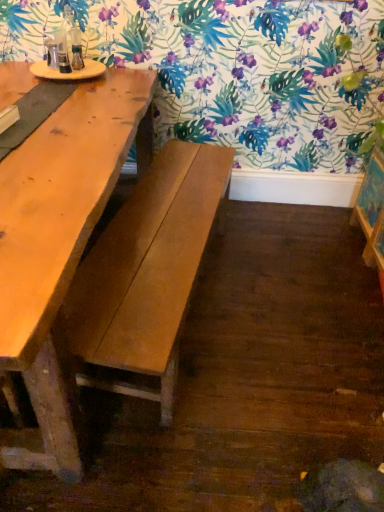
The height and width of the screenshot is (512, 384). What are the coordinates of `smooth wood bench at center` in the screenshot? It's located at (148, 271).

What is the approximate height of smooth wood bench at center?

smooth wood bench at center is 19.23 inches tall.

This screenshot has height=512, width=384. What do you see at coordinates (148, 271) in the screenshot? I see `smooth wood bench at center` at bounding box center [148, 271].

This screenshot has height=512, width=384. In order to click on smooth wood bench at center in this screenshot , I will do `click(148, 271)`.